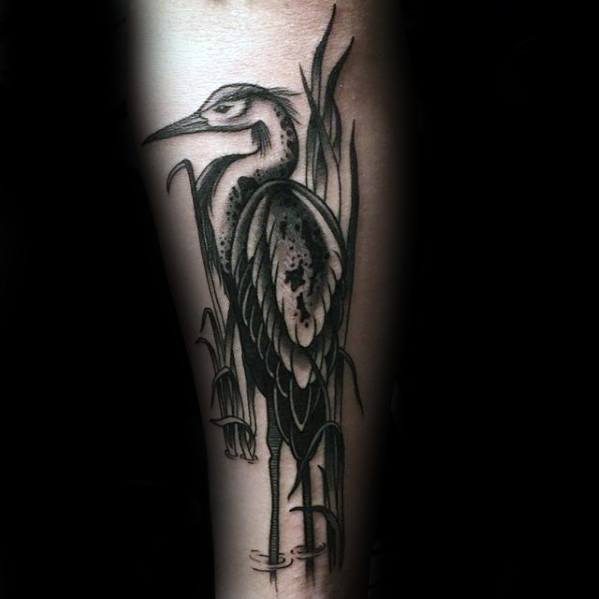
Where is `the left plant`? the left plant is located at coordinates (232, 406).